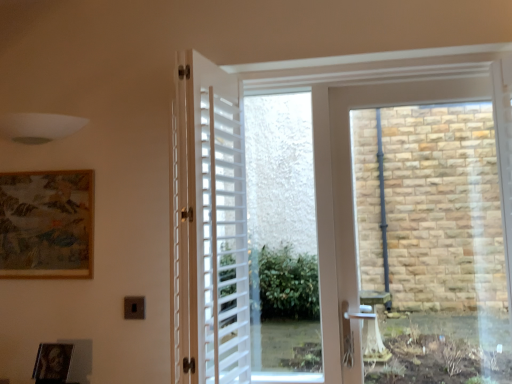
Question: Could you tell me if white matte shutter at center is turned towards black matte picture frame at lower left, the second picture frame viewed from the top?

Choices:
 (A) no
 (B) yes

Answer: (A)

Question: From a real-world perspective, is white matte shutter at center under black matte picture frame at lower left, the 1th picture frame ordered from the bottom?

Choices:
 (A) yes
 (B) no

Answer: (B)

Question: Is white matte shutter at center shorter than black matte picture frame at lower left, the second picture frame viewed from the top?

Choices:
 (A) no
 (B) yes

Answer: (A)

Question: From a real-world perspective, is white matte shutter at center on top of black matte picture frame at lower left, the 1th picture frame ordered from the bottom?

Choices:
 (A) yes
 (B) no

Answer: (A)

Question: Is black matte picture frame at lower left, the 1th picture frame from the front, surrounded by white matte shutter at center?

Choices:
 (A) no
 (B) yes

Answer: (A)

Question: In the image, is white matte shutter at center positioned in front of or behind black matte picture frame at lower left, the 1th picture frame ordered from the bottom?

Choices:
 (A) behind
 (B) front

Answer: (B)

Question: Is white matte shutter at center wider or thinner than black matte picture frame at lower left, the second picture frame viewed from the top?

Choices:
 (A) wide
 (B) thin

Answer: (A)

Question: From the image's perspective, relative to black matte picture frame at lower left, the 1th picture frame from the front, is white matte shutter at center above or below?

Choices:
 (A) below
 (B) above

Answer: (B)

Question: Choose the correct answer: Is white matte shutter at center inside black matte picture frame at lower left, the 1th picture frame ordered from the bottom, or outside it?

Choices:
 (A) inside
 (B) outside

Answer: (B)

Question: Visually, is wooden textured picture frame at upper left, the second picture frame from the bottom, positioned to the left or to the right of white matte shutter at center?

Choices:
 (A) right
 (B) left

Answer: (B)

Question: Is wooden textured picture frame at upper left, the second picture frame from the bottom, situated inside white matte shutter at center or outside?

Choices:
 (A) inside
 (B) outside

Answer: (B)

Question: From a real-world perspective, relative to white matte shutter at center, is wooden textured picture frame at upper left, the second picture frame from the front, vertically above or below?

Choices:
 (A) above
 (B) below

Answer: (A)

Question: Is wooden textured picture frame at upper left, the second picture frame from the bottom, wider or thinner than white matte shutter at center?

Choices:
 (A) wide
 (B) thin

Answer: (B)

Question: Is point (32, 372) closer or farther from the camera than point (223, 322)?

Choices:
 (A) farther
 (B) closer

Answer: (A)

Question: From the image's perspective, is black matte picture frame at lower left, the second picture frame viewed from the top, positioned above or below white matte shutter at center?

Choices:
 (A) above
 (B) below

Answer: (B)